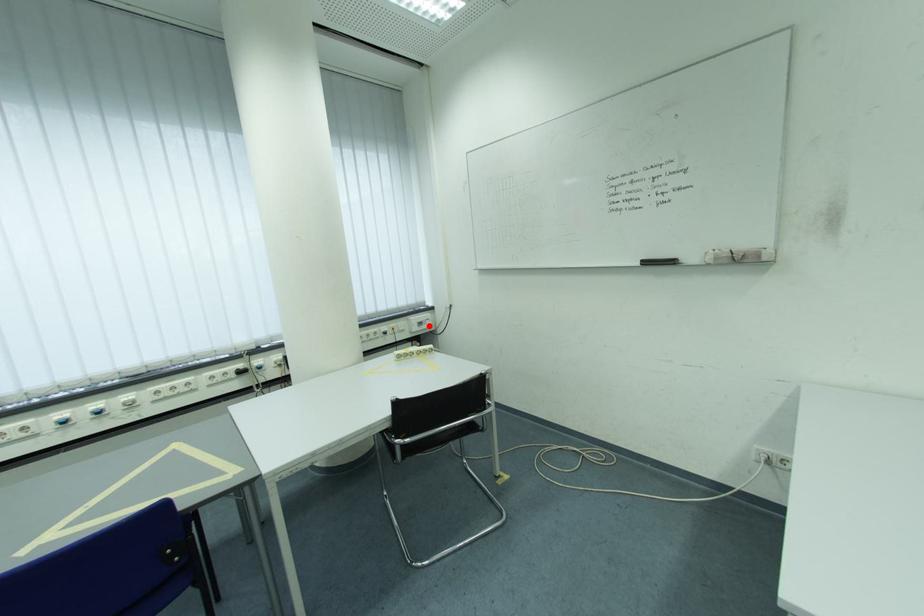
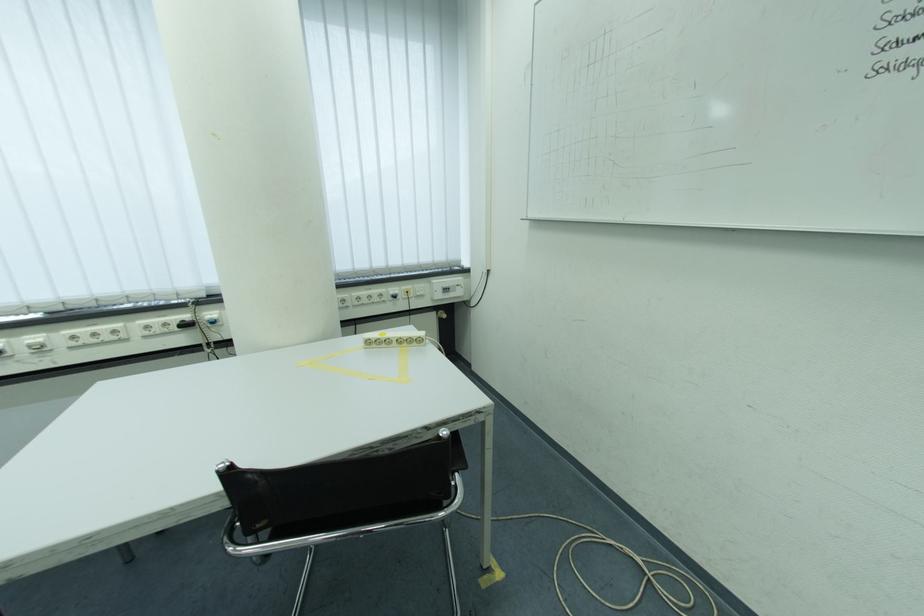
The point at the highlighted location is marked in the first image. Where is the corresponding point in the second image?

(455, 292)